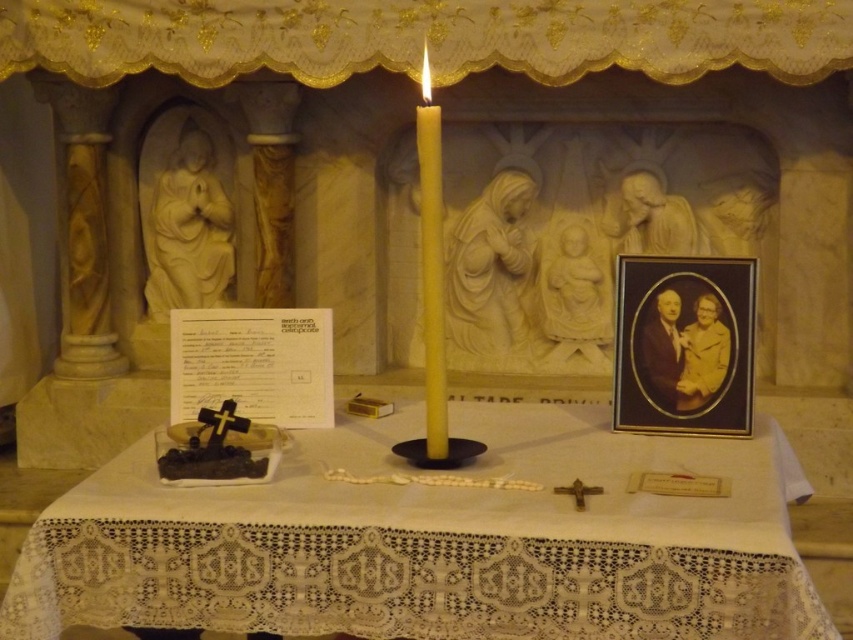
Is white lace tablecloth at center below white marble statue at upper left?

Yes.

Is point (117, 621) farther from camera compared to point (216, 282)?

No.

Is point (399, 524) behind point (177, 211)?

No, (399, 524) is closer to viewer.

Where is `white lace tablecloth at center`? This screenshot has height=640, width=853. white lace tablecloth at center is located at coordinates (433, 540).

Which is more to the right, white lace tablecloth at center or yellow wax candle at center?

From the viewer's perspective, white lace tablecloth at center appears more on the right side.

Which of these two, white lace tablecloth at center or yellow wax candle at center, stands taller?

yellow wax candle at center

Who is more distant from viewer, (665, 524) or (425, 211)?

Positioned behind is point (425, 211).

At what (x,y) coordinates should I click in order to perform the action: click on white lace tablecloth at center. Please return your answer as a coordinate pair (x, y). The image size is (853, 640). Looking at the image, I should click on (433, 540).

Describe the element at coordinates (184, 220) in the screenshot. This screenshot has height=640, width=853. I see `white marble statue at upper left` at that location.

What do you see at coordinates (184, 220) in the screenshot?
I see `white marble statue at upper left` at bounding box center [184, 220].

Find the location of a particular element. The height and width of the screenshot is (640, 853). white marble statue at upper left is located at coordinates (184, 220).